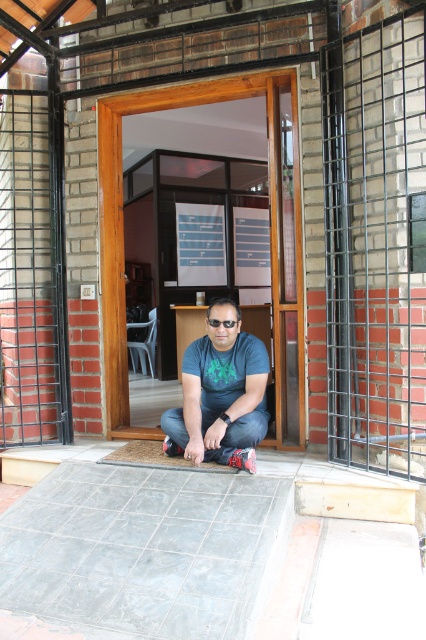
Question: Which of the following is the farthest from the observer?

Choices:
 (A) black metal gate at left
 (B) matte blue shirt at center

Answer: (A)

Question: Which of the following is the closest to the observer?

Choices:
 (A) matte blue shirt at center
 (B) black metal grid at right
 (C) black metal gate at left

Answer: (B)

Question: Where is black metal grid at right located in relation to black metal gate at left in the image?

Choices:
 (A) above
 (B) below

Answer: (A)

Question: Is black metal gate at left positioned before wooden door at center?

Choices:
 (A) yes
 (B) no

Answer: (B)

Question: Which point appears farthest from the camera in this image?

Choices:
 (A) (278, 420)
 (B) (233, 305)
 (C) (5, 369)
 (D) (408, 436)

Answer: (C)

Question: Is matte blue shirt at center behind black plastic goggles at center?

Choices:
 (A) yes
 (B) no

Answer: (B)